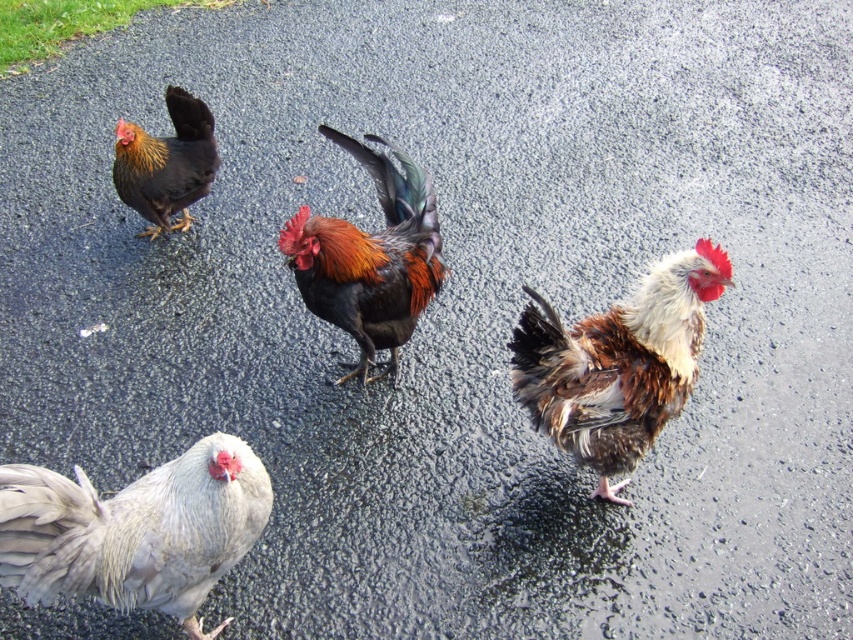
Question: Which point is farther to the camera?

Choices:
 (A) white feathered chicken at lower left
 (B) brown speckled feathers at center
 (C) black glossy rooster at upper left
 (D) shiny multicolored rooster at center

Answer: (C)

Question: Is brown speckled feathers at center behind shiny multicolored rooster at center?

Choices:
 (A) no
 (B) yes

Answer: (A)

Question: Does brown speckled feathers at center have a greater width compared to shiny multicolored rooster at center?

Choices:
 (A) yes
 (B) no

Answer: (A)

Question: Which object is positioned closest to the white feathered chicken at lower left?

Choices:
 (A) black glossy rooster at upper left
 (B) shiny multicolored rooster at center

Answer: (B)

Question: Does white feathered chicken at lower left appear under brown speckled feathers at center?

Choices:
 (A) yes
 (B) no

Answer: (A)

Question: Which object is the closest to the black glossy rooster at upper left?

Choices:
 (A) white feathered chicken at lower left
 (B) brown speckled feathers at center
 (C) shiny multicolored rooster at center

Answer: (C)